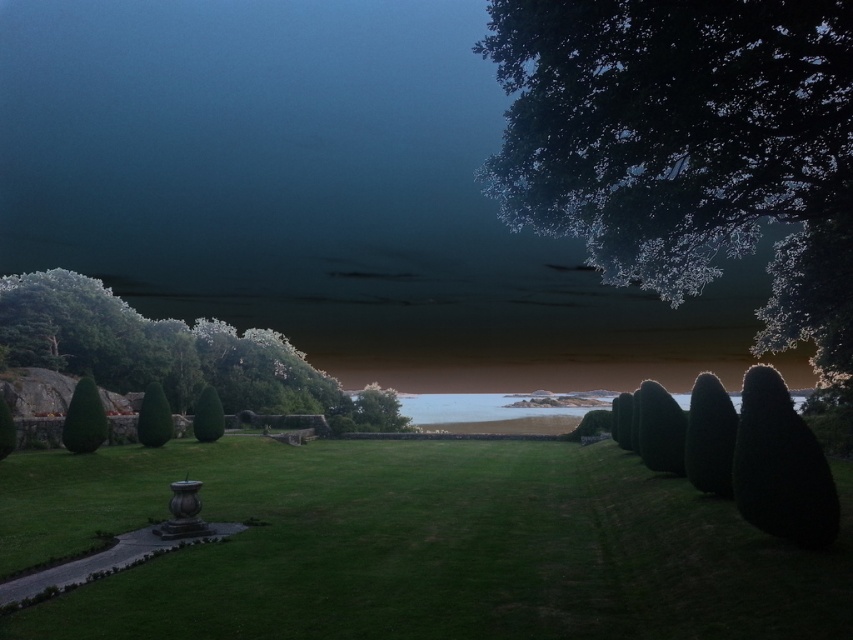
Question: Among these objects, which one is nearest to the camera?

Choices:
 (A) green leafy tree at lower left
 (B) green leafy tree at upper right

Answer: (B)

Question: Is green leafy tree at left wider than green leafy bush at center?

Choices:
 (A) no
 (B) yes

Answer: (B)

Question: Which point appears farthest from the camera in this image?

Choices:
 (A) (83, 292)
 (B) (62, 420)
 (C) (210, 397)
 (D) (158, 428)

Answer: (A)

Question: Which point appears closest to the camera in this image?

Choices:
 (A) (144, 403)
 (B) (212, 401)

Answer: (A)

Question: Is green leafy tree at lower left smaller than green textured hedge at lower left?

Choices:
 (A) no
 (B) yes

Answer: (B)

Question: Does green leafy tree at left appear over green leafy tree at lower left?

Choices:
 (A) yes
 (B) no

Answer: (A)